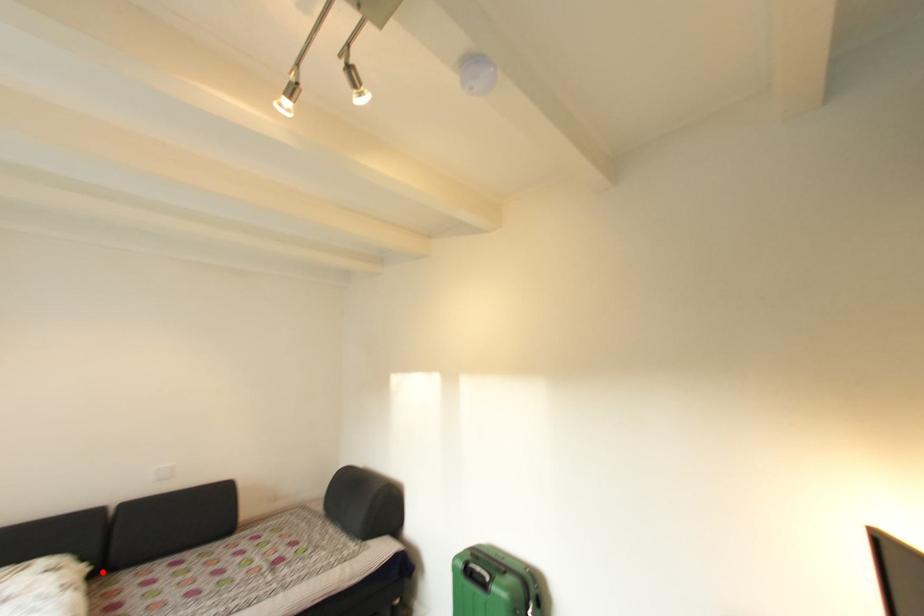
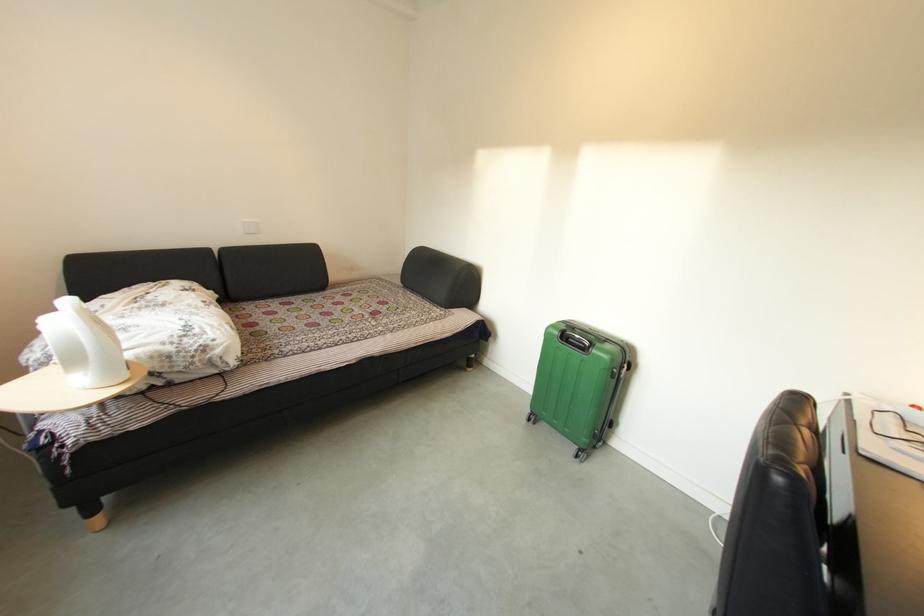
Question: I am providing you with two images of the same scene from different viewpoints. Image1 has a red point marked. In image2, the corresponding 3D location appears at what relative position? Reply with the corresponding letter.

Choices:
 (A) Closer
 (B) Farther

Answer: (A)